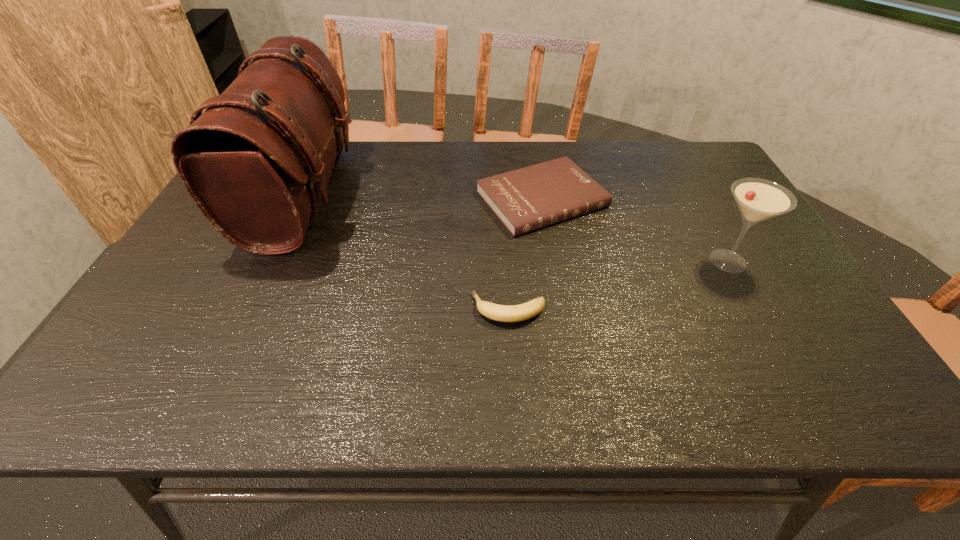
Image resolution: width=960 pixels, height=540 pixels. I want to click on the tallest object, so click(256, 161).

Locate an element on the screen. The height and width of the screenshot is (540, 960). satchel is located at coordinates (256, 161).

The image size is (960, 540). I want to click on martini, so click(758, 199).

The height and width of the screenshot is (540, 960). Find the location of `the rightmost object`. the rightmost object is located at coordinates (758, 199).

The height and width of the screenshot is (540, 960). In order to click on hardback book in this screenshot , I will do (x=526, y=199).

Where is `banana`? This screenshot has width=960, height=540. banana is located at coordinates (503, 313).

Where is `free space located 0.110m on the front-facing side of the satchel`? free space located 0.110m on the front-facing side of the satchel is located at coordinates (387, 195).

Find the location of a particular element. This screenshot has width=960, height=540. free space located 0.070m on the right of the third shortest object is located at coordinates (781, 261).

Find the location of `vacant space located 0.280m on the right of the hardback book`. vacant space located 0.280m on the right of the hardback book is located at coordinates (703, 199).

The width and height of the screenshot is (960, 540). In order to click on free location located 0.270m on the right of the nearest object in this screenshot , I will do `click(663, 309)`.